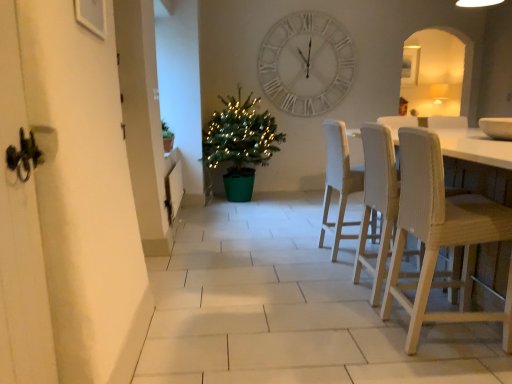
Question: Is white matte wall clock at upper center thinner than green plastic potted plant at center?

Choices:
 (A) yes
 (B) no

Answer: (A)

Question: Considering the relative sizes of white matte wall clock at upper center and green plastic potted plant at center in the image provided, is white matte wall clock at upper center smaller than green plastic potted plant at center?

Choices:
 (A) yes
 (B) no

Answer: (A)

Question: Does white matte wall clock at upper center touch green plastic potted plant at center?

Choices:
 (A) no
 (B) yes

Answer: (A)

Question: Is white matte wall clock at upper center oriented away from green plastic potted plant at center?

Choices:
 (A) no
 (B) yes

Answer: (A)

Question: From a real-world perspective, is white matte wall clock at upper center on top of green plastic potted plant at center?

Choices:
 (A) yes
 (B) no

Answer: (A)

Question: Is white fabric chair at center, which is counted as the first chair, starting from the back, in front of or behind white woven chair at right, marked as the second chair in a front-to-back arrangement, in the image?

Choices:
 (A) behind
 (B) front

Answer: (A)

Question: In the image, is white fabric chair at center, which is counted as the first chair, starting from the back, on the left side or the right side of white woven chair at right, marked as the second chair in a front-to-back arrangement?

Choices:
 (A) right
 (B) left

Answer: (B)

Question: From a real-world perspective, relative to white woven chair at right, the 2th chair from the back, is white fabric chair at center, which is counted as the first chair, starting from the back, vertically above or below?

Choices:
 (A) above
 (B) below

Answer: (B)

Question: Is white fabric chair at center, acting as the third chair starting from the front, situated inside white woven chair at right, the 2th chair from the back, or outside?

Choices:
 (A) inside
 (B) outside

Answer: (B)

Question: Is white woven chair at right, the 2th chair from the back, in front of or behind white matte wall clock at upper center in the image?

Choices:
 (A) behind
 (B) front

Answer: (B)

Question: Is white woven chair at right, the 2th chair from the back, taller or shorter than white matte wall clock at upper center?

Choices:
 (A) short
 (B) tall

Answer: (A)

Question: From a real-world perspective, is white woven chair at right, the 2th chair from the back, positioned above or below white matte wall clock at upper center?

Choices:
 (A) above
 (B) below

Answer: (B)

Question: Does point (362, 230) appear closer or farther from the camera than point (325, 71)?

Choices:
 (A) farther
 (B) closer

Answer: (B)

Question: Considering the positions of white woven chair at right, the 2th chair from the back, and white fabric chair at center, acting as the third chair starting from the front, in the image, is white woven chair at right, the 2th chair from the back, taller or shorter than white fabric chair at center, acting as the third chair starting from the front,?

Choices:
 (A) tall
 (B) short

Answer: (B)

Question: Is point (355, 261) positioned closer to the camera than point (339, 195)?

Choices:
 (A) closer
 (B) farther

Answer: (A)